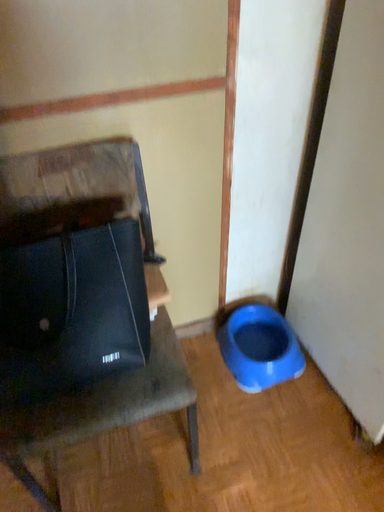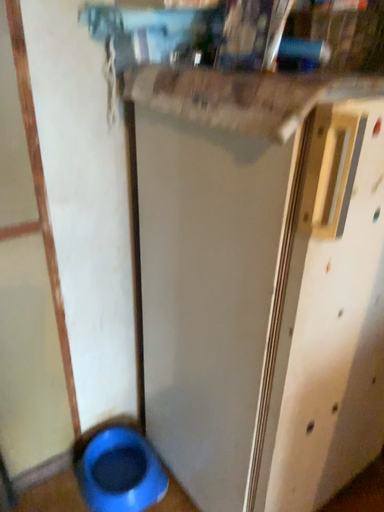
Question: Which way did the camera rotate in the video?

Choices:
 (A) rotated downward
 (B) rotated upward

Answer: (B)